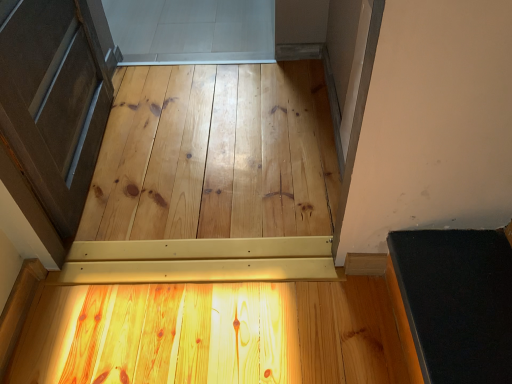
Question: From their relative heights in the image, would you say natural wood plywood at center, marked as the second plywood in a bottom-to-top arrangement, is taller or shorter than light brown polished wood at center, the 2th plywood from the top?

Choices:
 (A) tall
 (B) short

Answer: (B)

Question: From a real-world perspective, is natural wood plywood at center, which is the second plywood from front to back, positioned above or below light brown polished wood at center, which is counted as the 2th plywood, starting from the back?

Choices:
 (A) above
 (B) below

Answer: (B)

Question: Is natural wood plywood at center, the first plywood when ordered from back to front, in front of or behind light brown polished wood at center, the 2th plywood from the top, in the image?

Choices:
 (A) behind
 (B) front

Answer: (A)

Question: Is light brown polished wood at center, the 1th plywood when ordered from bottom to top, wider or thinner than natural wood plywood at center, which is the 1th plywood from top to bottom?

Choices:
 (A) wide
 (B) thin

Answer: (B)

Question: From the image's perspective, is light brown polished wood at center, the 2th plywood from the top, positioned above or below natural wood plywood at center, the first plywood when ordered from back to front?

Choices:
 (A) above
 (B) below

Answer: (B)

Question: Does point (293, 311) appear closer or farther from the camera than point (120, 233)?

Choices:
 (A) closer
 (B) farther

Answer: (A)

Question: From their relative heights in the image, would you say light brown polished wood at center, the 2th plywood from the top, is taller or shorter than natural wood plywood at center, marked as the second plywood in a bottom-to-top arrangement?

Choices:
 (A) tall
 (B) short

Answer: (A)